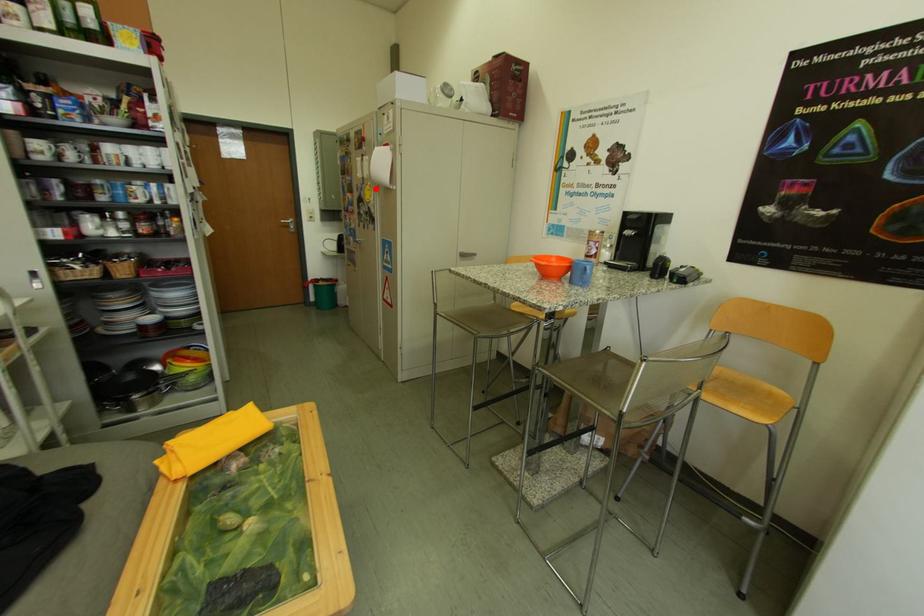
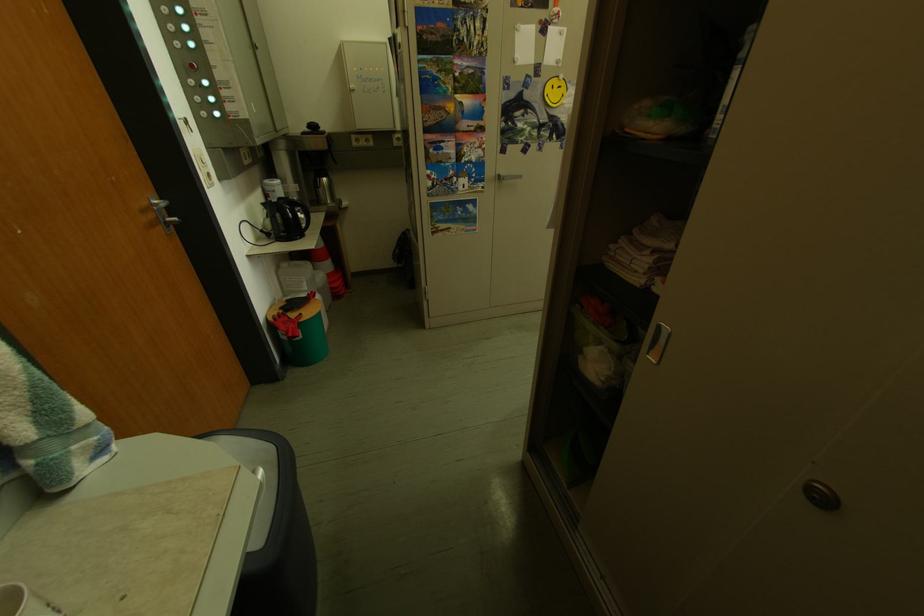
The point at the highlighted location is marked in the first image. Where is the corresponding point in the second image?

(546, 82)